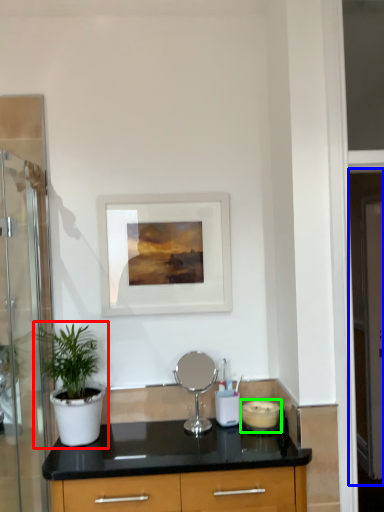
Question: Based on their relative distances, which object is farther from houseplant (highlighted by a red box)? Choose from screen door (highlighted by a blue box) and appliance (highlighted by a green box).

Choices:
 (A) screen door
 (B) appliance

Answer: (A)